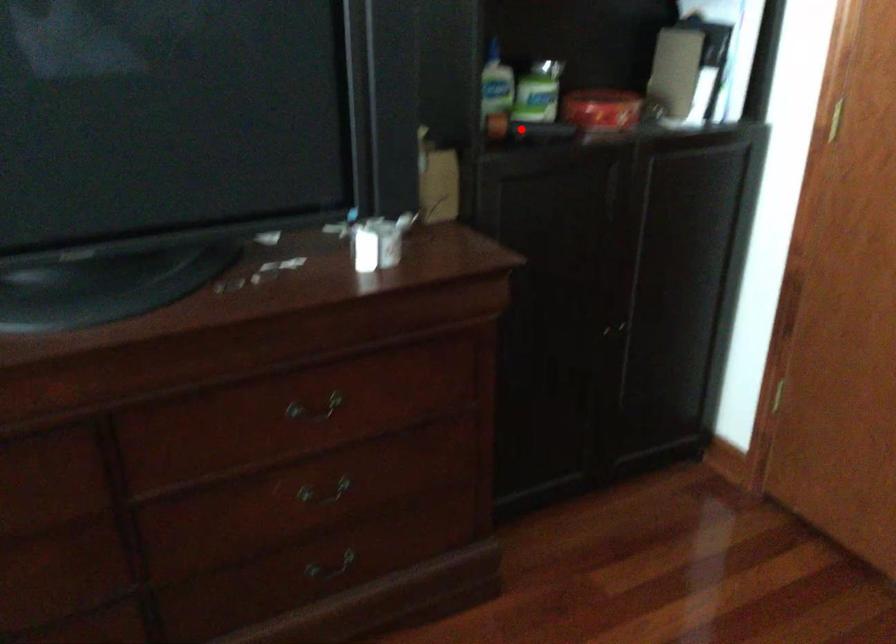
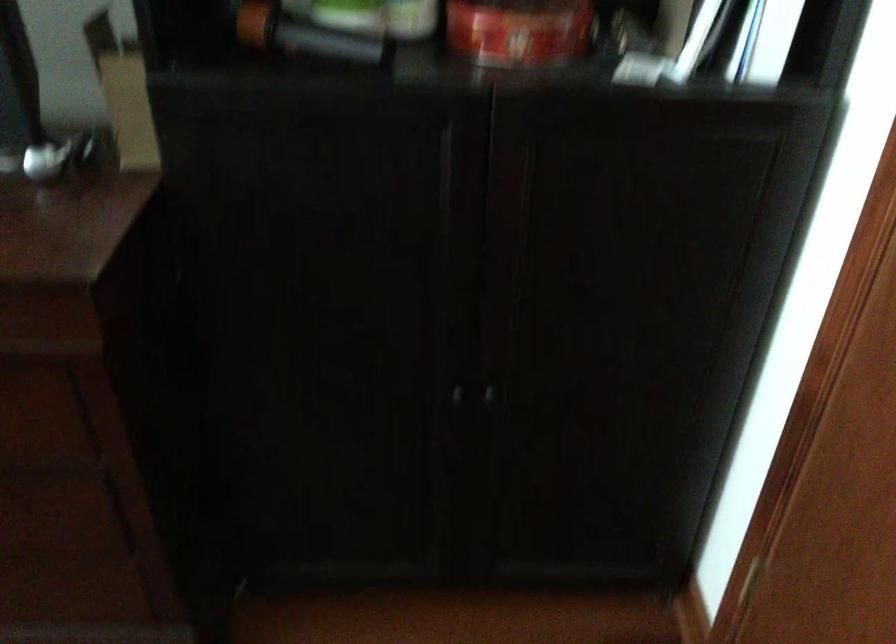
Question: I am providing you with two images of the same scene from different viewpoints. In image1, a red point is highlighted. Considering the same 3D point in image2, which of the following is correct?

Choices:
 (A) It is closer
 (B) It is farther

Answer: (A)